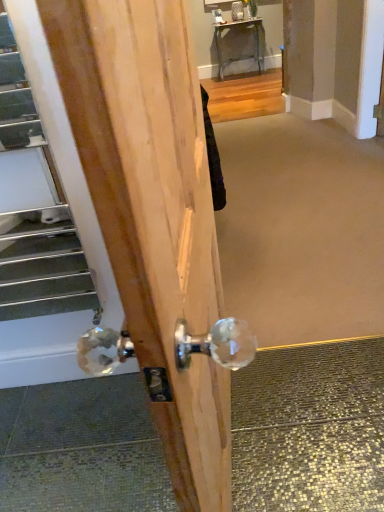
Question: From the image's perspective, is metallic silver table at upper center positioned above or below metallic silver escalator at lower left?

Choices:
 (A) above
 (B) below

Answer: (A)

Question: Which is correct: metallic silver table at upper center is inside metallic silver escalator at lower left, or outside of it?

Choices:
 (A) inside
 (B) outside

Answer: (B)

Question: Estimate the real-world distances between objects in this image. Which object is farther from the clear crystal doorknob at center?

Choices:
 (A) metallic silver escalator at lower left
 (B) metallic silver table at upper center

Answer: (B)

Question: Which object is the closest to the clear crystal doorknob at center?

Choices:
 (A) metallic silver table at upper center
 (B) metallic silver escalator at lower left

Answer: (B)